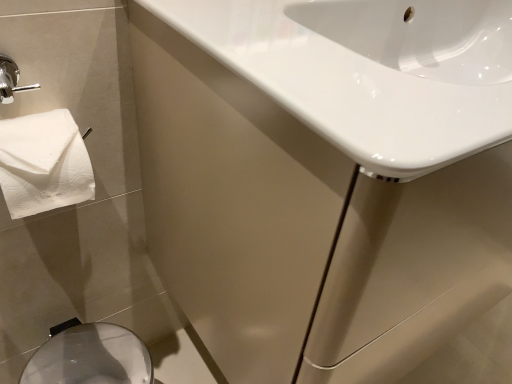
Where is `white glossy sink at upper right`? white glossy sink at upper right is located at coordinates (370, 71).

The width and height of the screenshot is (512, 384). I want to click on silver metallic bidet at lower left, so click(x=90, y=357).

Locate an element on the screen. The height and width of the screenshot is (384, 512). white glossy sink at upper right is located at coordinates (233, 204).

Is white glossy sink at upper right facing away from white glossy sink at upper right?

That's not correct — white glossy sink at upper right is not looking away from white glossy sink at upper right.

Does point (193, 280) appear closer or farther from the camera than point (450, 117)?

Point (193, 280) is positioned farther from the camera compared to point (450, 117).

Between white glossy sink at upper right and white glossy sink at upper right, which one is positioned in front?

white glossy sink at upper right is closer to the camera.

Would you say white glossy sink at upper right is to the left or to the right of white glossy sink at upper right in the picture?

Based on their positions, white glossy sink at upper right is located to the left of white glossy sink at upper right.

Between silver metallic bidet at lower left and white glossy sink at upper right, which one has smaller size?

silver metallic bidet at lower left.

Is silver metallic bidet at lower left thinner than white glossy sink at upper right?

Yes.

Is silver metallic bidet at lower left turned away from white glossy sink at upper right?

No.

In order to click on sink in front of the silver metallic bidet at lower left in this screenshot , I will do `click(370, 71)`.

Which of these two, white glossy sink at upper right or white glossy sink at upper right, stands taller?

white glossy sink at upper right is taller.

Who is smaller, white glossy sink at upper right or white glossy sink at upper right?

With smaller size is white glossy sink at upper right.

Looking at this image, measure the distance from white glossy sink at upper right to white glossy sink at upper right.

The distance of white glossy sink at upper right from white glossy sink at upper right is 7.90 inches.

Is white glossy sink at upper right positioned with its back to white glossy sink at upper right?

Yes, white glossy sink at upper right is facing away from white glossy sink at upper right.

Which of these two, white glossy sink at upper right or silver metallic bidet at lower left, is smaller?

Smaller between the two is silver metallic bidet at lower left.

Considering the relative sizes of white glossy sink at upper right and silver metallic bidet at lower left in the image provided, is white glossy sink at upper right thinner than silver metallic bidet at lower left?

No.

Can you confirm if white glossy sink at upper right is positioned to the right of silver metallic bidet at lower left?

Yes, white glossy sink at upper right is to the right of silver metallic bidet at lower left.

Locate an element on the screen. The height and width of the screenshot is (384, 512). bidet on the left of white glossy sink at upper right is located at coordinates (90, 357).

From a real-world perspective, between white glossy sink at upper right and silver metallic bidet at lower left, who is vertically higher?

In real-world perspective, white glossy sink at upper right is above.

In the image, there is a white glossy sink at upper right. Where is `bidet below it (from the image's perspective)`? The width and height of the screenshot is (512, 384). bidet below it (from the image's perspective) is located at coordinates (90, 357).

From the image's perspective, is white glossy sink at upper right on top of silver metallic bidet at lower left?

Yes, from the image's perspective, white glossy sink at upper right is above silver metallic bidet at lower left.

In the image, is white glossy sink at upper right positioned in front of or behind silver metallic bidet at lower left?

Visually, white glossy sink at upper right is located in front of silver metallic bidet at lower left.

Which of these two, silver metallic bidet at lower left or white glossy sink at upper right, is wider?

Wider between the two is white glossy sink at upper right.

How many degrees apart are the facing directions of silver metallic bidet at lower left and white glossy sink at upper right?

The angle between the facing direction of silver metallic bidet at lower left and the facing direction of white glossy sink at upper right is 0.928 degrees.

Between point (34, 365) and point (154, 78), which one is positioned behind?

The point (34, 365) is more distant.

From the image's perspective, which one is positioned higher, silver metallic bidet at lower left or white glossy sink at upper right?

white glossy sink at upper right is shown above in the image.

Identify the location of screen door located below the white glossy sink at upper right (from the image's perspective). This screenshot has width=512, height=384. (233, 204).

Where is `sink on the right of silver metallic bidet at lower left`? sink on the right of silver metallic bidet at lower left is located at coordinates (370, 71).

Estimate the real-world distances between objects in this image. Which object is further from silver metallic bidet at lower left, white glossy sink at upper right or white glossy sink at upper right?

Among the two, white glossy sink at upper right is located further to silver metallic bidet at lower left.

Which object lies nearer to the anchor point white glossy sink at upper right, silver metallic bidet at lower left or white glossy sink at upper right?

The object closer to white glossy sink at upper right is white glossy sink at upper right.

Estimate the real-world distances between objects in this image. Which object is further from white glossy sink at upper right, white glossy sink at upper right or silver metallic bidet at lower left?

Based on the image, silver metallic bidet at lower left appears to be further to white glossy sink at upper right.

Based on their spatial positions, is silver metallic bidet at lower left or white glossy sink at upper right further from white glossy sink at upper right?

silver metallic bidet at lower left is further to white glossy sink at upper right.

From the image, which object appears to be farther from silver metallic bidet at lower left, white glossy sink at upper right or white glossy sink at upper right?

The object further to silver metallic bidet at lower left is white glossy sink at upper right.

Considering their positions, is white glossy sink at upper right positioned closer to white glossy sink at upper right than silver metallic bidet at lower left?

white glossy sink at upper right is closer to white glossy sink at upper right.

Image resolution: width=512 pixels, height=384 pixels. I want to click on screen door between silver metallic bidet at lower left and white glossy sink at upper right from left to right, so click(x=233, y=204).